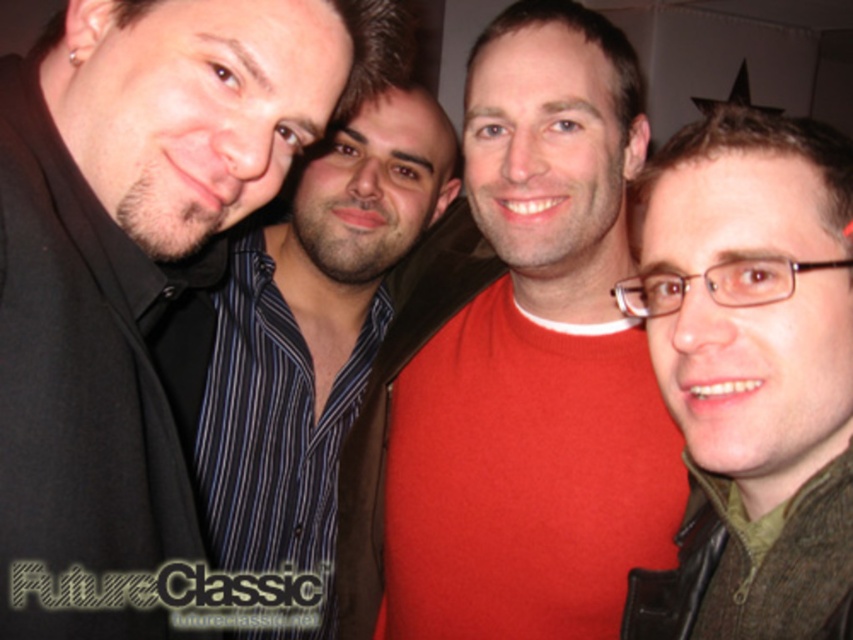
Can you confirm if matte black shirt at left is bigger than striped shirt at center?

Actually, matte black shirt at left might be smaller than striped shirt at center.

Which is more to the left, matte black shirt at left or striped shirt at center?

matte black shirt at left

Describe the element at coordinates (128, 260) in the screenshot. This screenshot has width=853, height=640. I see `matte black shirt at left` at that location.

Identify the location of matte black shirt at left. This screenshot has width=853, height=640. (128, 260).

Is point (206, 54) closer to viewer compared to point (814, 381)?

No, (206, 54) is further to viewer.

How much distance is there between matte black shirt at left and green wool sweater at right?

matte black shirt at left is 45.57 centimeters away from green wool sweater at right.

Between point (83, 122) and point (706, 580), which one is positioned in front?

Point (83, 122) is in front.

Where is `matte black shirt at left`? matte black shirt at left is located at coordinates (128, 260).

Is red matte shirt at center positioned behind striped shirt at center?

That is False.

Which is in front, point (412, 609) or point (416, 112)?

Point (412, 609)

Which is in front, point (430, 474) or point (329, 380)?

Point (430, 474) is in front.

I want to click on red matte shirt at center, so click(517, 369).